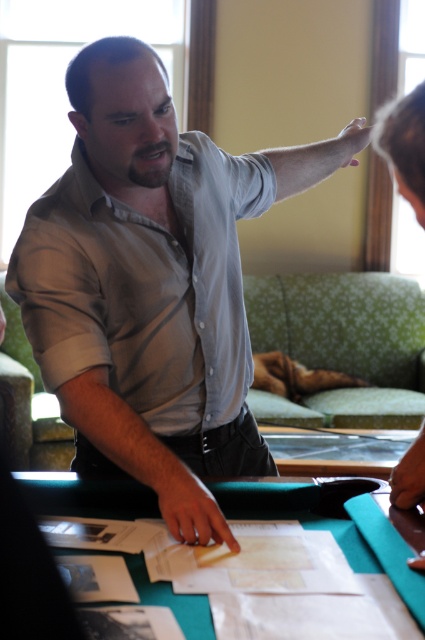
Is gray matte shirt at center thinner than matte gray shirt at upper center?

Incorrect, gray matte shirt at center's width is not less than matte gray shirt at upper center's.

Which of these two, gray matte shirt at center or matte gray shirt at upper center, stands shorter?

matte gray shirt at upper center is shorter.

Is point (133, 424) farther from camera compared to point (388, 125)?

That is True.

You are a GUI agent. You are given a task and a screenshot of the screen. Output one action in this format:
    pyautogui.click(x=<x>, y=<y>)
    Task: Click on the gray matte shirt at center
    
    Given the screenshot: What is the action you would take?
    pyautogui.click(x=121, y=422)

Who is more forward, [150,104] or [413,148]?

Point [413,148] is in front.

Between point (221, 301) and point (410, 205), which one is positioned behind?

Positioned behind is point (221, 301).

At what (x,y) coordinates should I click in order to perform the action: click on matte gray shirt at center. Please return your answer as a coordinate pair (x, y). The width and height of the screenshot is (425, 640). Looking at the image, I should click on (153, 284).

Locate an element on the screen. The width and height of the screenshot is (425, 640). matte gray shirt at center is located at coordinates (153, 284).

Does matte gray shirt at upper center have a larger size compared to gray fabric arm at upper center?

Incorrect, matte gray shirt at upper center is not larger than gray fabric arm at upper center.

Does matte gray shirt at upper center appear on the left side of gray fabric arm at upper center?

No, matte gray shirt at upper center is not to the left of gray fabric arm at upper center.

Is point (393, 138) less distant than point (292, 189)?

Yes, it is.

In order to click on matte gray shirt at upper center in this screenshot , I will do `click(405, 145)`.